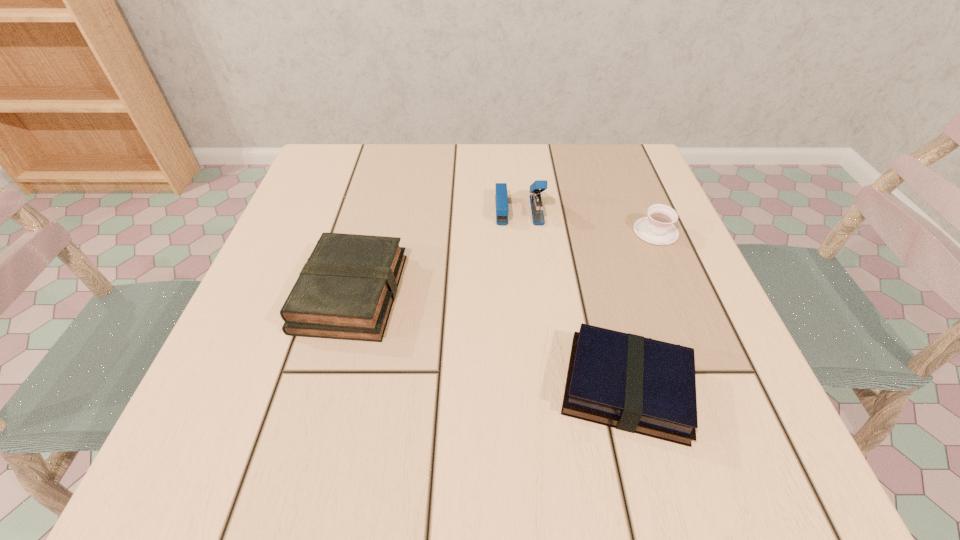
The image size is (960, 540). In the image, there is a desktop. Identify the location of free region at the far right corner. (623, 197).

Where is `blank region between the teacup and the right book`? This screenshot has width=960, height=540. blank region between the teacup and the right book is located at coordinates (641, 309).

You are a GUI agent. You are given a task and a screenshot of the screen. Output one action in this format:
    pyautogui.click(x=<x>, y=<y>)
    Task: Click on the free spot between the teacup and the left book
    The height and width of the screenshot is (540, 960).
    Given the screenshot: What is the action you would take?
    pyautogui.click(x=503, y=262)

Locate an element on the screen. Image resolution: width=960 pixels, height=540 pixels. vacant space that is in between the teacup and the stapler is located at coordinates (588, 220).

Image resolution: width=960 pixels, height=540 pixels. I want to click on vacant point located between the stapler and the teacup, so pos(588,220).

In order to click on unoccupied position between the teacup and the tallest object in this screenshot , I will do `click(588, 220)`.

Locate an element on the screen. Image resolution: width=960 pixels, height=540 pixels. free space between the teacup and the shorter book is located at coordinates (641, 309).

Locate an element on the screen. Image resolution: width=960 pixels, height=540 pixels. vacant area that lies between the right book and the teacup is located at coordinates (641, 309).

The width and height of the screenshot is (960, 540). Find the location of `vacant area between the teacup and the right book`. vacant area between the teacup and the right book is located at coordinates (641, 309).

This screenshot has height=540, width=960. In order to click on unoccupied position between the stapler and the shorter book in this screenshot , I will do [x=573, y=299].